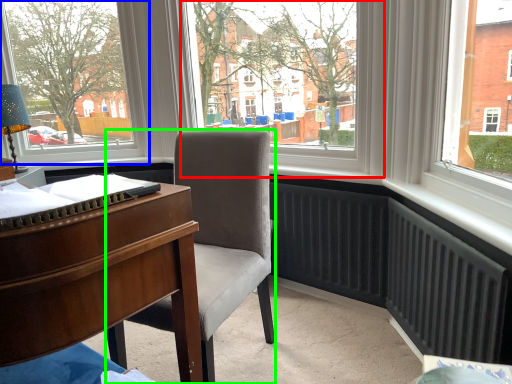
Question: Which object is positioned farthest from window screen (highlighted by a red box)? Select from window (highlighted by a blue box) and chair (highlighted by a green box).

Choices:
 (A) window
 (B) chair

Answer: (A)